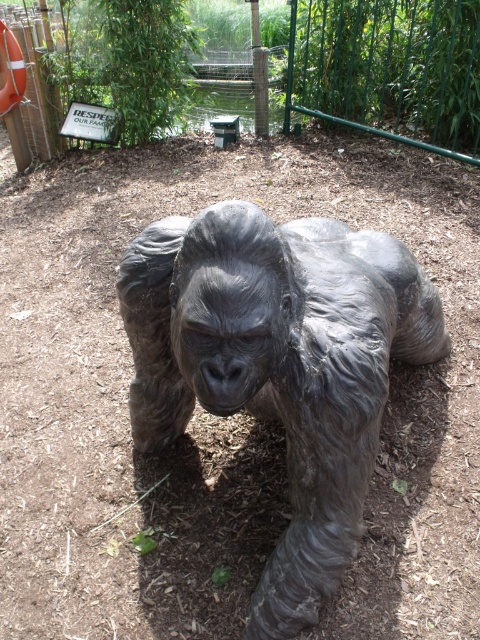
Between bronze statue at center and green metal fence at upper center, which one appears on the left side from the viewer's perspective?

bronze statue at center

Does point (307, 312) lie behind point (444, 84)?

That is False.

Identify the location of bronze statue at center. (278, 365).